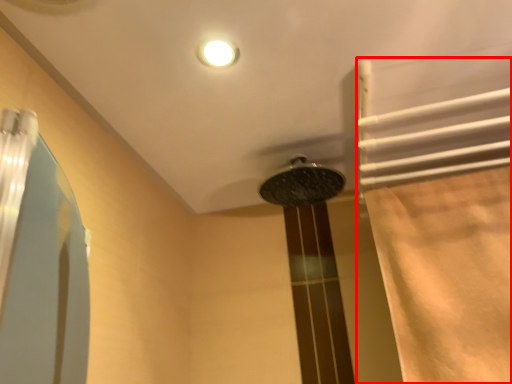
Question: Considering the relative positions of shower curtain (annotated by the red box) and shower in the image provided, where is shower curtain (annotated by the red box) located with respect to the staircase?

Choices:
 (A) left
 (B) right

Answer: (B)